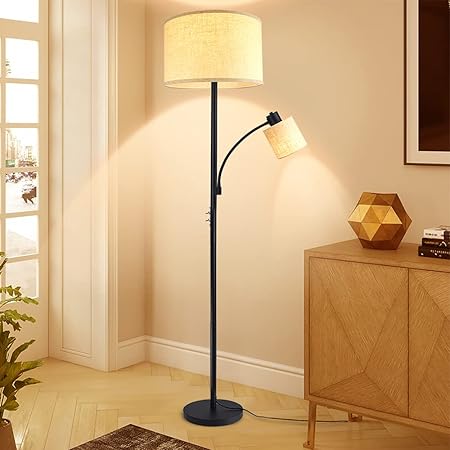
What are the coordinates of `cabinet` in the screenshot? It's located at (347, 379).